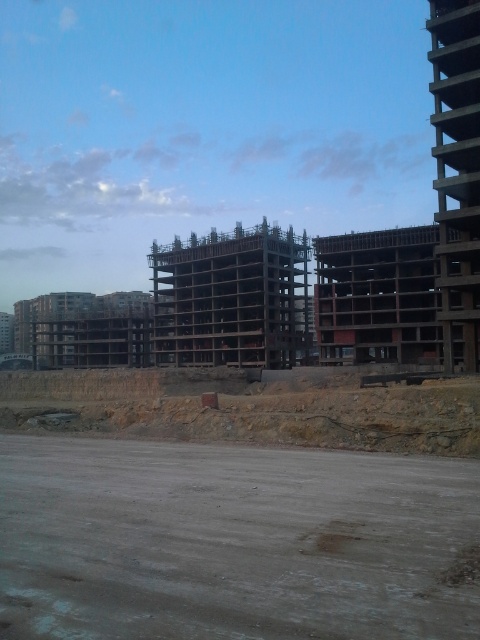
Which is above, dark wood building at center or wooden frame building at center?

dark wood building at center

Find the location of a particular element. dark wood building at center is located at coordinates (231, 298).

Between dirt at center and wooden frame building at center, which one has less height?

With less height is dirt at center.

Which is in front, point (237, 413) or point (360, 237)?

Point (237, 413) is more forward.

Find the location of a particular element. dirt at center is located at coordinates (236, 506).

Which is above, dirt at center or dark wood building at center?

dark wood building at center is higher up.

Is point (432, 492) positioned after point (196, 364)?

No.

Between point (327, 545) and point (285, 356), which one is positioned in front?

Point (327, 545)

You are a GUI agent. You are given a task and a screenshot of the screen. Output one action in this format:
    pyautogui.click(x=<x>, y=<y>)
    Task: Click on the dirt at center
    Image resolution: width=480 pixels, height=640 pixels.
    Given the screenshot: What is the action you would take?
    pyautogui.click(x=236, y=506)